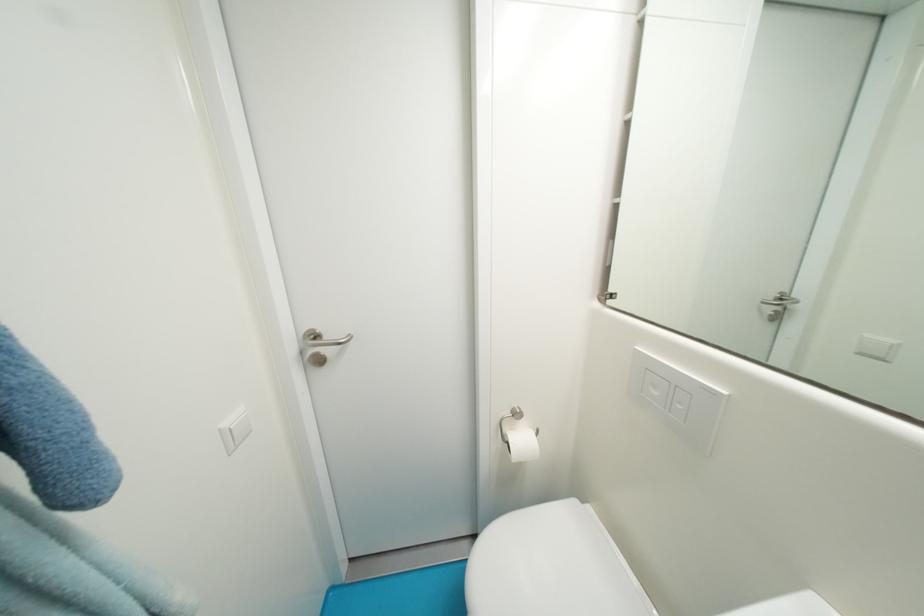
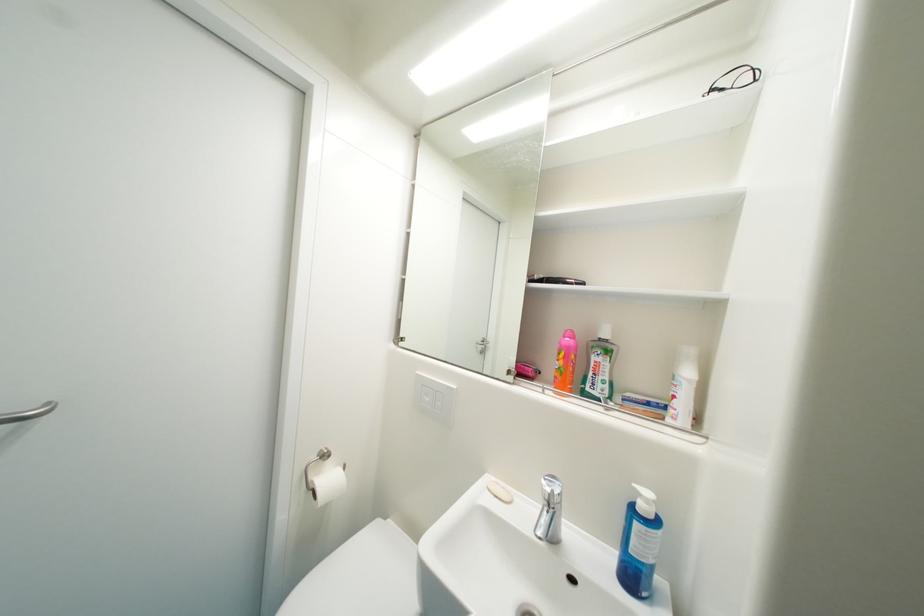
Where in the second image is the point corresponding to point (662, 395) from the first image?

(433, 400)